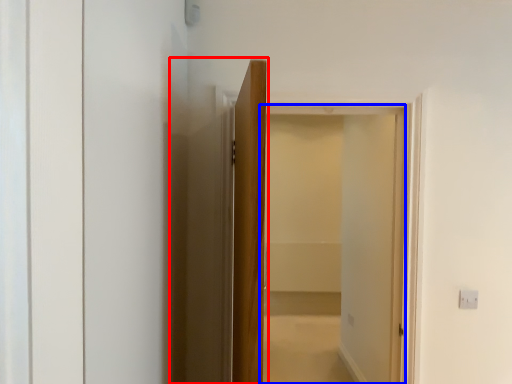
Question: Among these objects, which one is farthest to the camera, elevator (highlighted by a red box) or screen door (highlighted by a blue box)?

Choices:
 (A) elevator
 (B) screen door

Answer: (B)